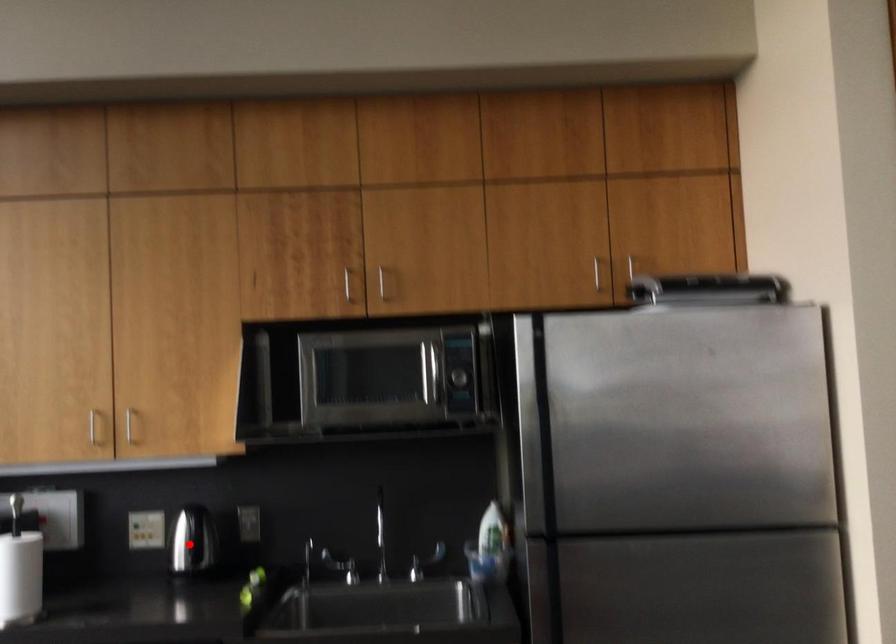
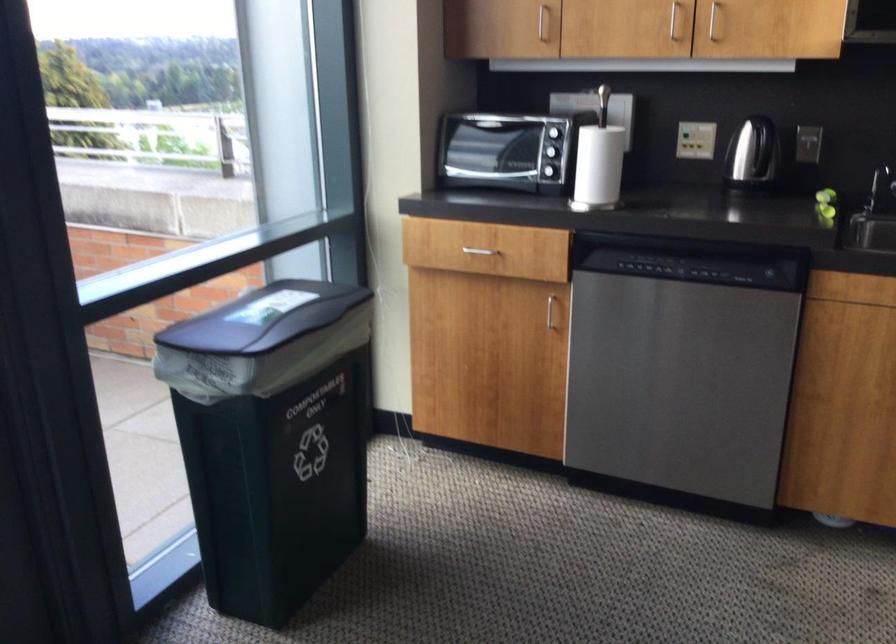
The point at the highlighted location is marked in the first image. Where is the corresponding point in the second image?

(752, 152)